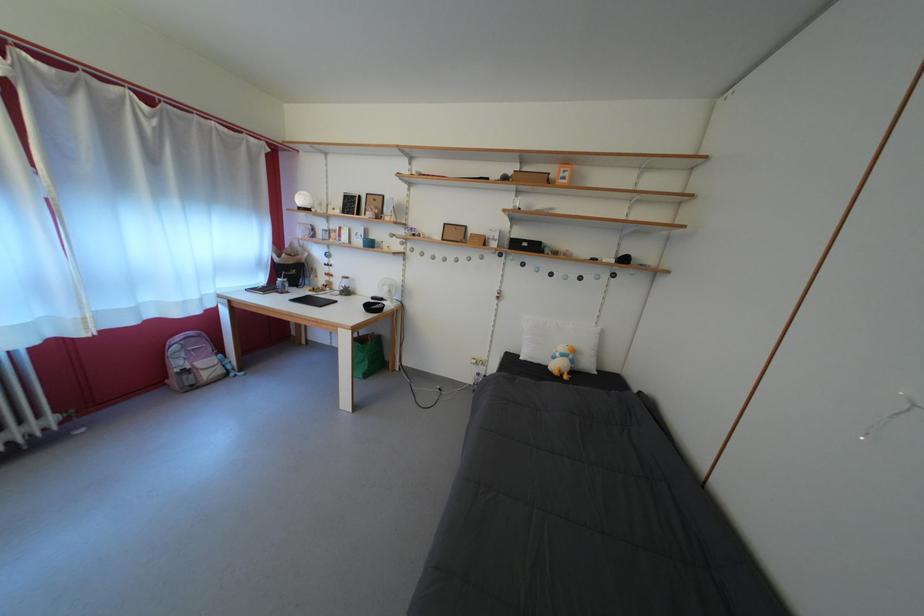
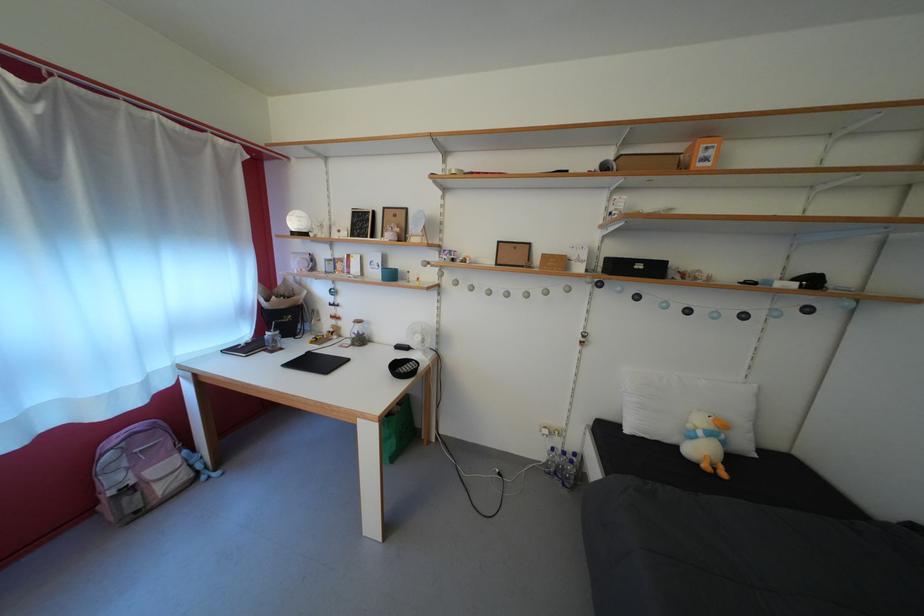
Question: The first image is from the beginning of the video and the second image is from the end. How did the camera likely rotate when shooting the video?

Choices:
 (A) Left
 (B) Right
 (C) Up
 (D) Down

Answer: (C)